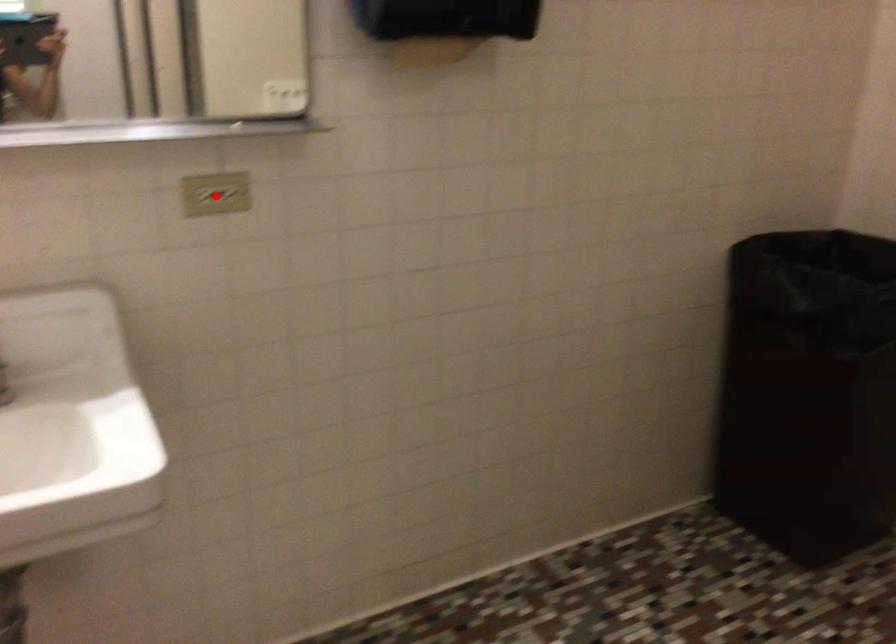
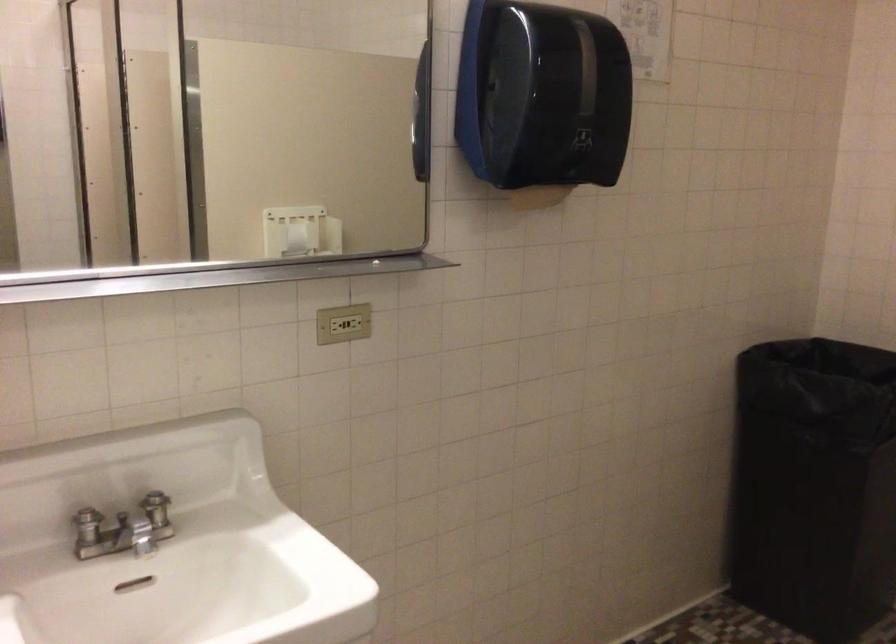
Locate, in the second image, the point that corresponds to the highlighted location in the first image.

(342, 323)